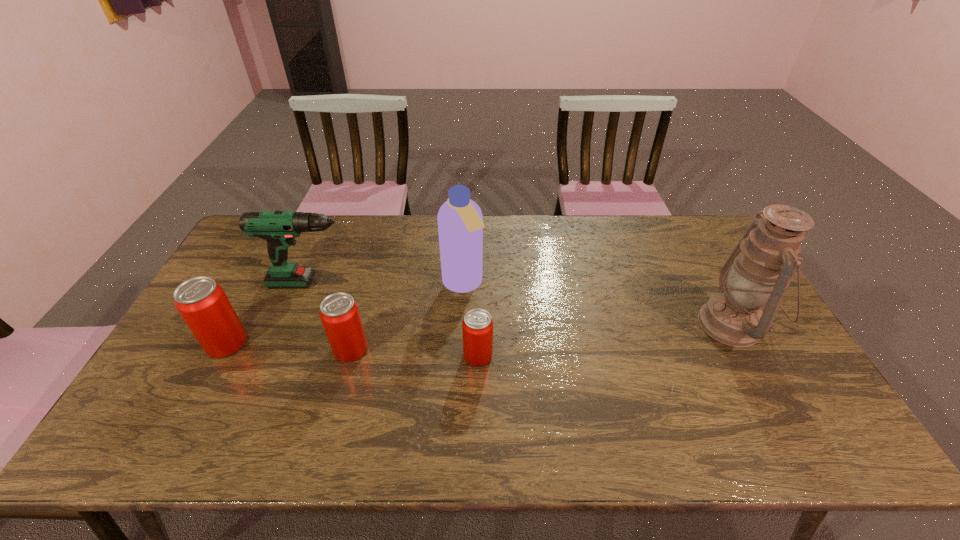
You are a GUI agent. You are given a task and a screenshot of the screen. Output one action in this format:
    pyautogui.click(x=<x>, y=<y>)
    Task: Click on the vacant place for an extra can on the right
    The image size is (960, 540).
    Given the screenshot: What is the action you would take?
    pyautogui.click(x=609, y=362)